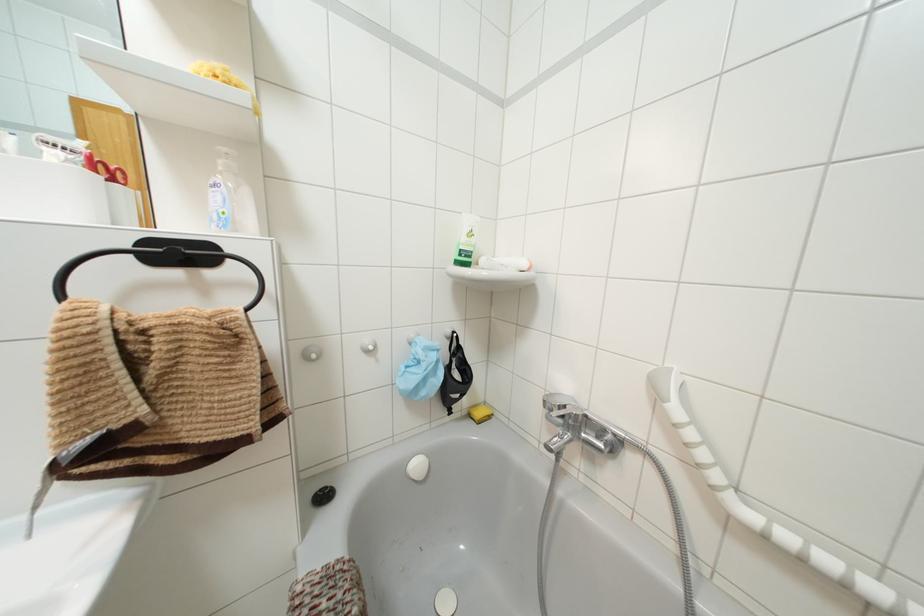
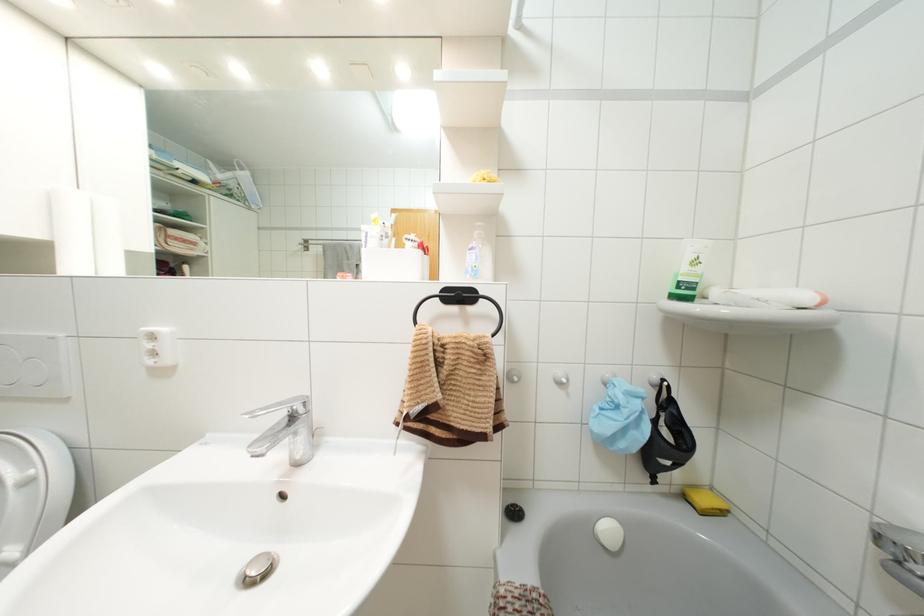
Where in the second image is the point corresponding to point (223, 148) from the first image?

(479, 223)